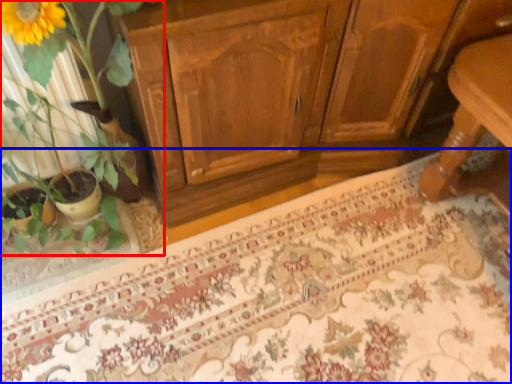
Question: Which object appears closest to the camera in this image, houseplant (highlighted by a red box) or doormat (highlighted by a blue box)?

Choices:
 (A) houseplant
 (B) doormat

Answer: (A)